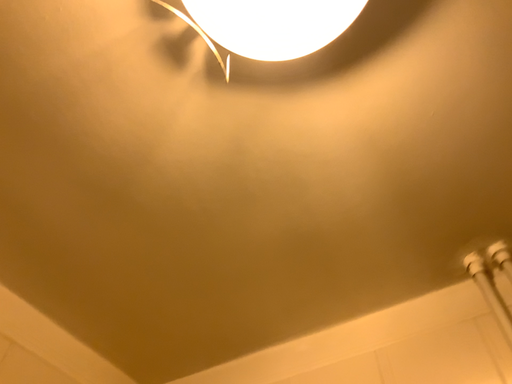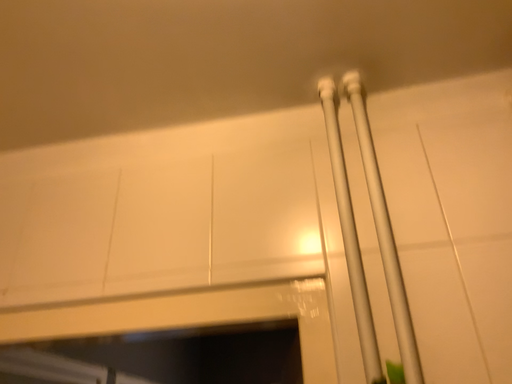
Question: How did the camera likely rotate when shooting the video?

Choices:
 (A) rotated right
 (B) rotated left

Answer: (A)